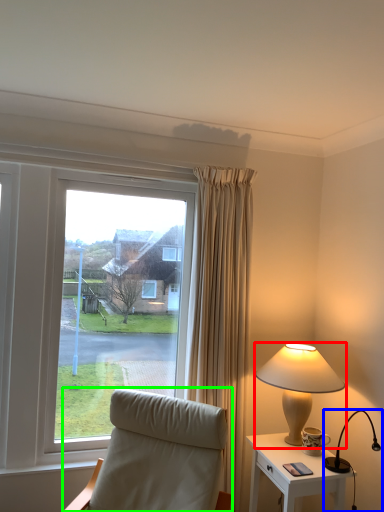
Question: Estimate the real-world distances between objects in this image. Which object is closer to lamp (highlighted by a red box), lamp (highlighted by a blue box) or chair (highlighted by a green box)?

Choices:
 (A) lamp
 (B) chair

Answer: (A)